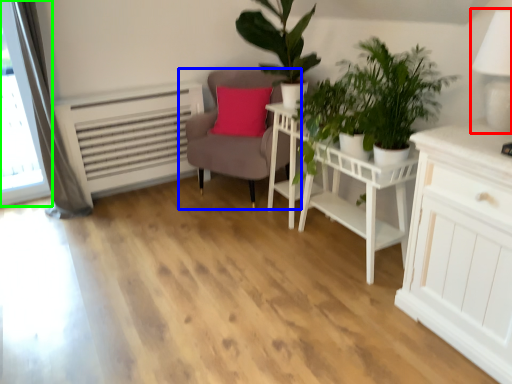
Question: Which object is the farthest from table lamp (highlighted by a red box)? Choose among these: chair (highlighted by a blue box) or window (highlighted by a green box).

Choices:
 (A) chair
 (B) window

Answer: (B)